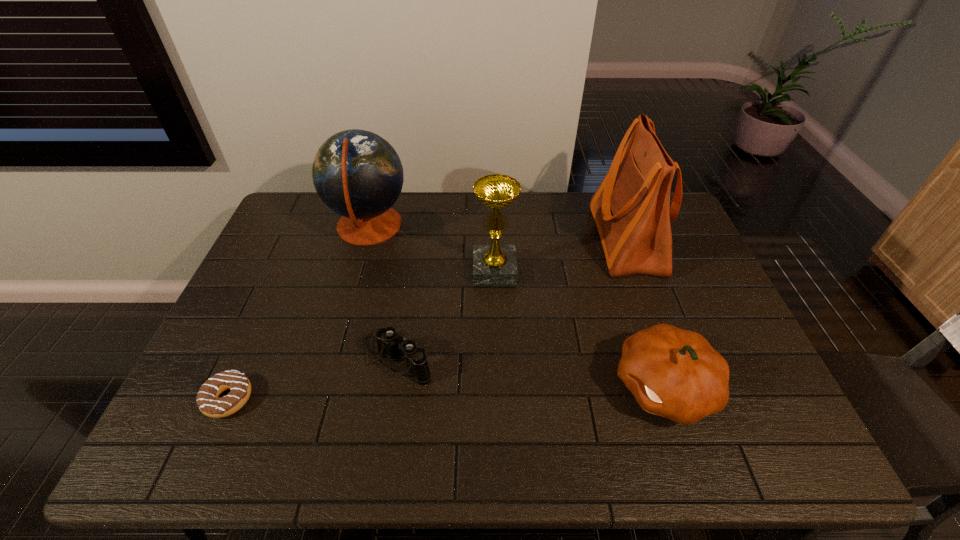
Identify the location of shopping bag. This screenshot has height=540, width=960. (631, 208).

Where is `globe`? globe is located at coordinates (357, 174).

At what (x,y) coordinates should I click in order to perform the action: click on the fourth object from left to right. Please return your answer as a coordinate pair (x, y). The width and height of the screenshot is (960, 540). Looking at the image, I should click on (492, 264).

Locate an element on the screen. The width and height of the screenshot is (960, 540). the fourth shortest object is located at coordinates [x=492, y=264].

Identify the location of pumpkin. Image resolution: width=960 pixels, height=540 pixels. (674, 373).

Where is `the fifth tallest object`? the fifth tallest object is located at coordinates (388, 340).

At what (x,y) coordinates should I click in order to perform the action: click on the leftmost object. Please return your answer as a coordinate pair (x, y). Image resolution: width=960 pixels, height=540 pixels. Looking at the image, I should click on (209, 404).

I want to click on doughnut, so click(x=209, y=404).

What are the coordinates of `vacant area situated 0.200m on the front pocket of the shopping bag` in the screenshot? It's located at (534, 240).

Identify the location of free spot located on the front pocket of the shopping bag. This screenshot has height=540, width=960. (513, 240).